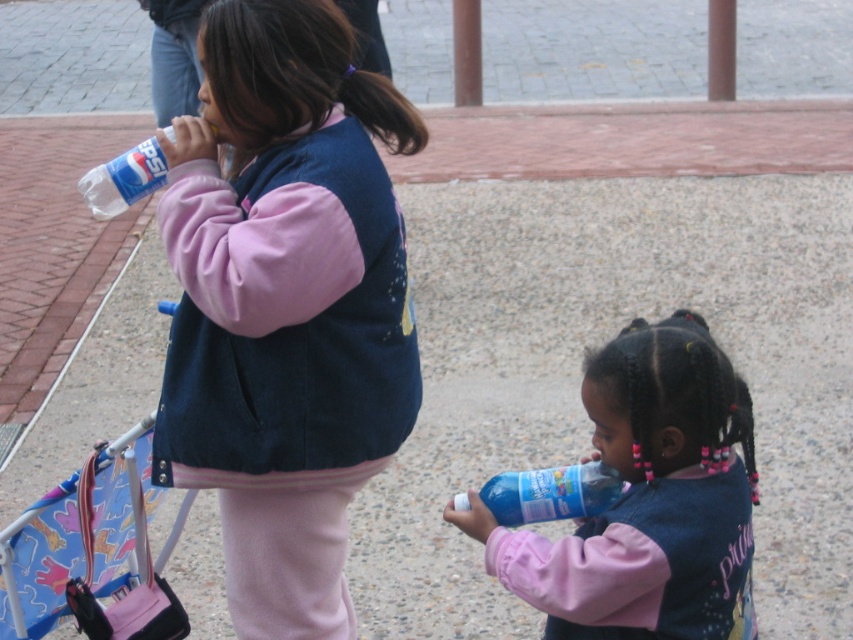
Is blue plastic bottle at center to the left of blue translucent bottle at lower center from the viewer's perspective?

Incorrect, blue plastic bottle at center is not on the left side of blue translucent bottle at lower center.

Is point (718, 461) positioned before point (555, 515)?

Yes.

Is point (735, 426) positioned behind point (579, 480)?

No, it is not.

At what (x,y) coordinates should I click in order to perform the action: click on blue plastic bottle at center. Please return your answer as a coordinate pair (x, y). The height and width of the screenshot is (640, 853). Looking at the image, I should click on (647, 499).

Is point (724, 433) positioned after point (50, 529)?

No, it is not.

Is blue plastic bottle at center behind multicolored fabric baby carriage at left?

No, blue plastic bottle at center is in front of multicolored fabric baby carriage at left.

Who is more forward, (637, 561) or (96, 577)?

Positioned in front is point (637, 561).

Image resolution: width=853 pixels, height=640 pixels. I want to click on blue plastic bottle at center, so click(647, 499).

Is multicolored fabric baby carriage at left wider than white plastic bottle at upper left?

Indeed, multicolored fabric baby carriage at left has a greater width compared to white plastic bottle at upper left.

Which is in front, point (33, 577) or point (212, 129)?

Point (212, 129) is in front.

The height and width of the screenshot is (640, 853). I want to click on multicolored fabric baby carriage at left, so click(x=77, y=540).

The width and height of the screenshot is (853, 640). I want to click on multicolored fabric baby carriage at left, so click(77, 540).